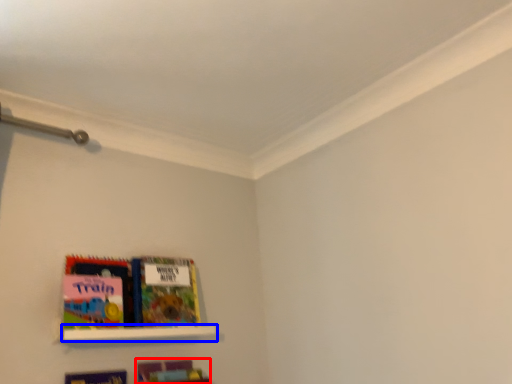
Question: Which object appears closest to the camera in this image, book (highlighted by a red box) or shelf (highlighted by a blue box)?

Choices:
 (A) book
 (B) shelf

Answer: (B)